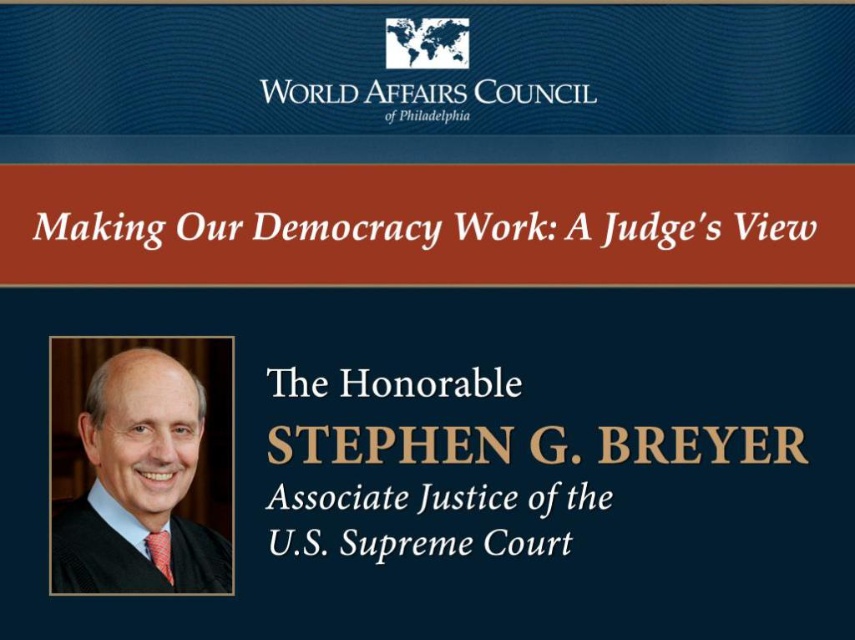
Who is more distant from viewer, [150,365] or [225,236]?

Positioned behind is point [225,236].

The height and width of the screenshot is (640, 855). Describe the element at coordinates (139, 483) in the screenshot. I see `black robe at left` at that location.

The image size is (855, 640). What do you see at coordinates (139, 483) in the screenshot?
I see `black robe at left` at bounding box center [139, 483].

Locate an element on the screen. The width and height of the screenshot is (855, 640). black robe at left is located at coordinates (139, 483).

Can you confirm if black robe at left is positioned to the right of white paper text at center?

In fact, black robe at left is to the left of white paper text at center.

Between point (144, 424) and point (404, 545), which one is positioned behind?

The point (404, 545) is more distant.

The image size is (855, 640). Find the location of `black robe at left`. black robe at left is located at coordinates (139, 483).

Does red paper text at upper center have a larger size compared to white paper at upper center?

Indeed, red paper text at upper center has a larger size compared to white paper at upper center.

Measure the distance from red paper text at upper center to white paper at upper center.

A distance of 29.89 inches exists between red paper text at upper center and white paper at upper center.

Does point (705, 212) come farther from viewer compared to point (443, 394)?

Yes, point (705, 212) is behind point (443, 394).

Locate an element on the screen. The width and height of the screenshot is (855, 640). red paper text at upper center is located at coordinates (345, 228).